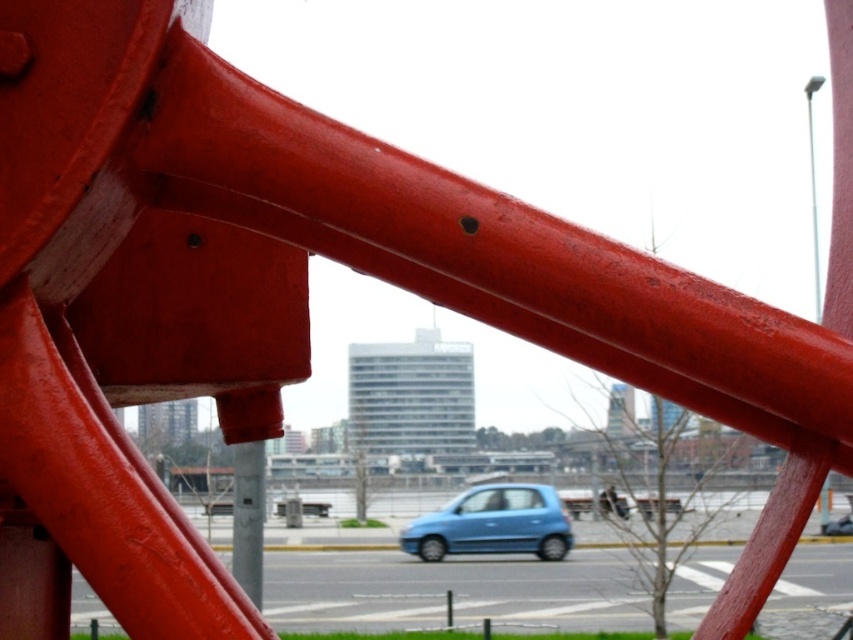
You are a delivery driver who needs to park your truck next to the matte blue car at center and the metallic gray pole at center. Based on the scene, can your truck fit between them without touching either?

The matte blue car at center might be wider than the metallic gray pole at center, so there is uncertainty about the available space. To ensure safety, measure the distance between them before attempting to park.

You are standing on the sidewalk and see the matte blue car at center and the metallic gray pole at center. Which object is closer to the ground?

The matte blue car at center is located below the metallic gray pole at center, so it is closer to the ground.

You are a delivery drone operator. Your drone needs to fly over the matte blue car at center and the metallic gray pole at center. Based on their heights, which object will require the drone to ascend higher to safely pass over?

The matte blue car at center is taller than the metallic gray pole at center, so the drone will need to ascend higher to safely pass over the matte blue car at center.